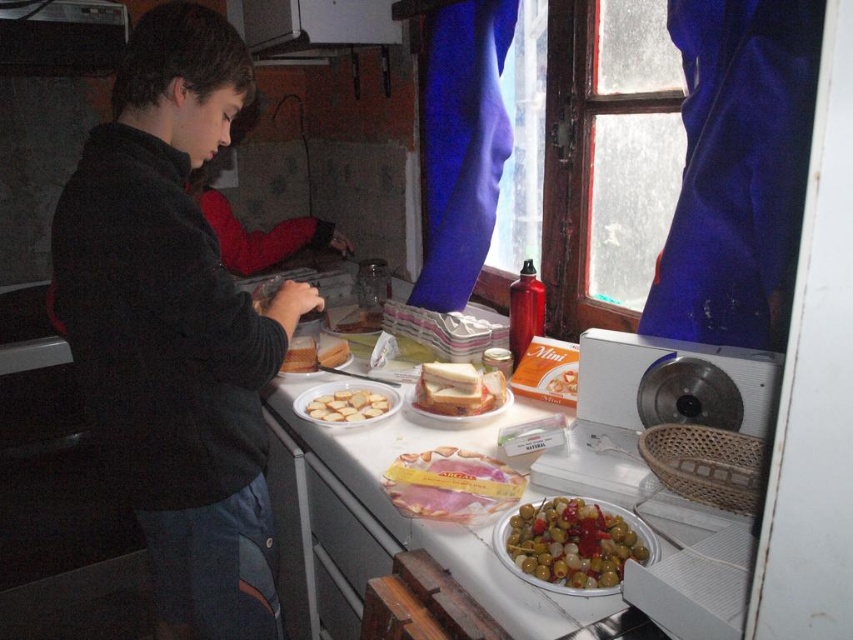
You are a chef preparing a sandwich and you have the sliced pink ham at center and the matte white bread at center on the counter. Which ingredient is on top of the other?

The sliced pink ham at center is positioned under matte white bread at center, so the matte white bread at center is on top.

You are standing in the kitchen and want to reach the point marked at coordinates [486,483]. If your arm can extend 1 meter, can you reach that point without moving your body?

The point at [486,483] is 1.18 meters away from you, so your arm can only extend 1 meter, meaning you cannot reach it without moving your body.